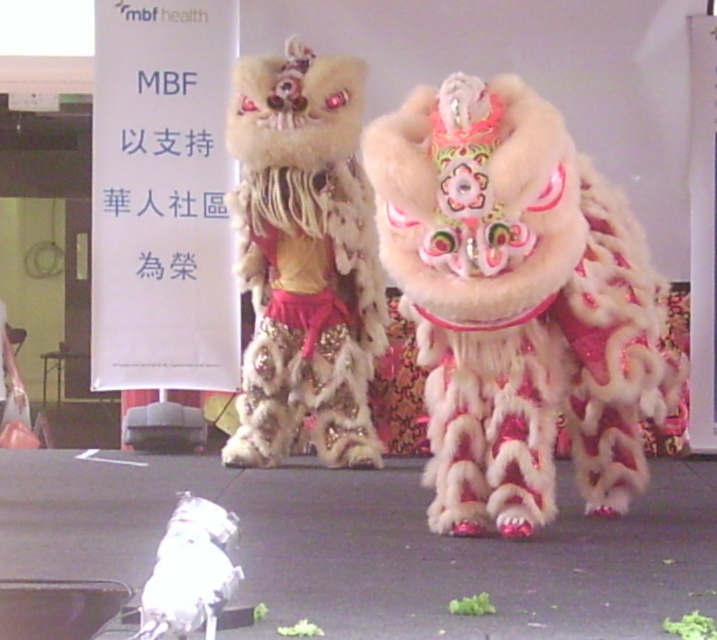
Between fuzzy white lion at center and fuzzy beige lion at center, which one appears on the right side from the viewer's perspective?

From the viewer's perspective, fuzzy white lion at center appears more on the right side.

Locate an element on the screen. fuzzy white lion at center is located at coordinates (516, 304).

The image size is (717, 640). Find the location of `fuzzy white lion at center`. fuzzy white lion at center is located at coordinates (516, 304).

Locate an element on the screen. fuzzy white lion at center is located at coordinates (516, 304).

Looking at this image, does fuzzy white lion at center have a smaller size compared to white fluffy cat at lower left?

Actually, fuzzy white lion at center might be larger than white fluffy cat at lower left.

Measure the distance between point (478,310) and camera.

Point (478,310) and camera are 2.44 meters apart.

Locate an element on the screen. This screenshot has width=717, height=640. fuzzy white lion at center is located at coordinates (516, 304).

Can you confirm if fuzzy beige lion at center is positioned to the left of white fluffy cat at lower left?

Incorrect, fuzzy beige lion at center is not on the left side of white fluffy cat at lower left.

Who is more forward, (x=277, y=284) or (x=161, y=620)?

Point (x=161, y=620)

Locate an element on the screen. The image size is (717, 640). fuzzy beige lion at center is located at coordinates click(x=303, y=259).